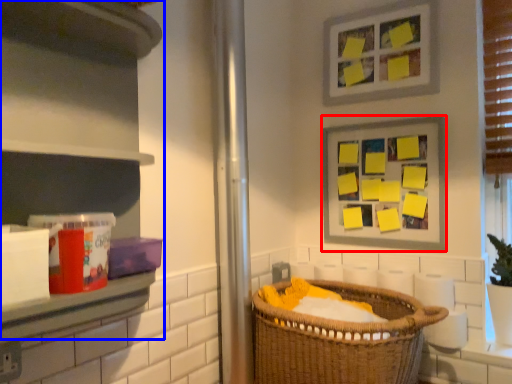
Question: Which object appears closest to the camera in this image, picture frame (highlighted by a red box) or cabinet (highlighted by a blue box)?

Choices:
 (A) picture frame
 (B) cabinet

Answer: (B)